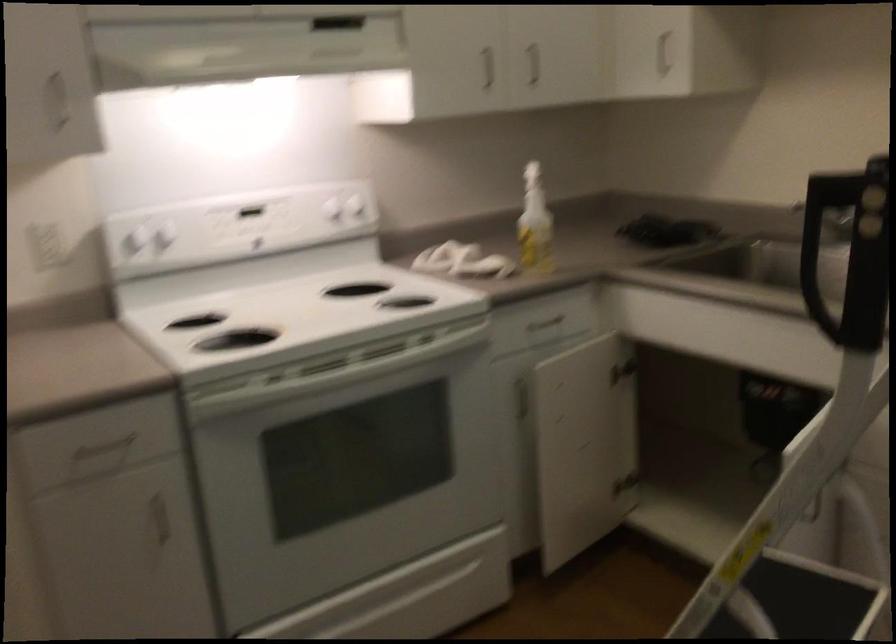
The image size is (896, 644). What do you see at coordinates (409, 596) in the screenshot?
I see `a oven door handle` at bounding box center [409, 596].